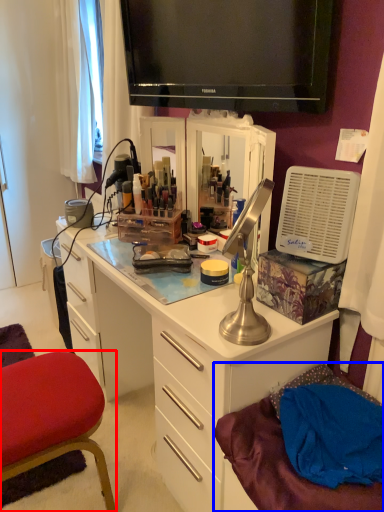
Question: Which object appears farthest to the camera in this image, chair (highlighted by a red box) or wide (highlighted by a blue box)?

Choices:
 (A) chair
 (B) wide

Answer: (A)